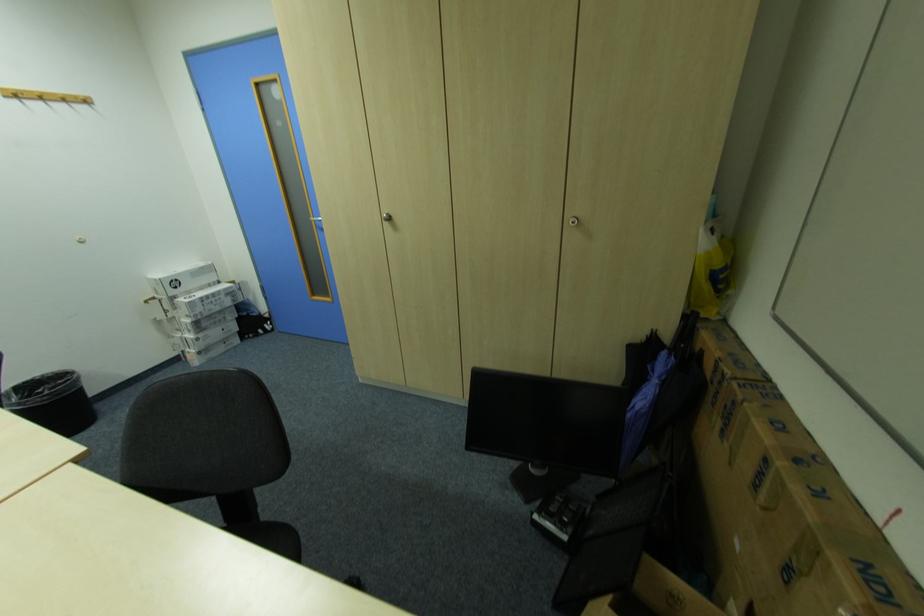
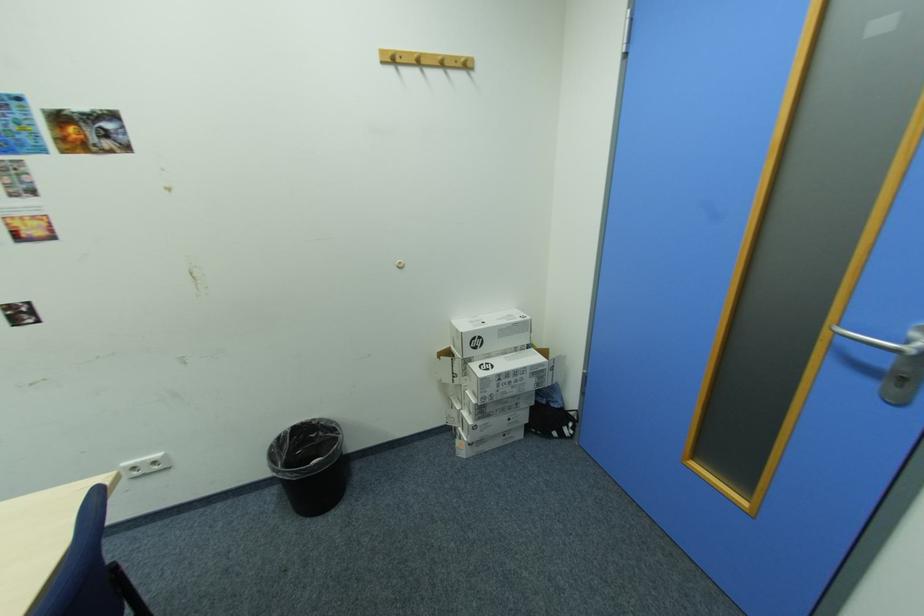
The point at (49, 391) is marked in the first image. Where is the corresponding point in the second image?

(322, 436)